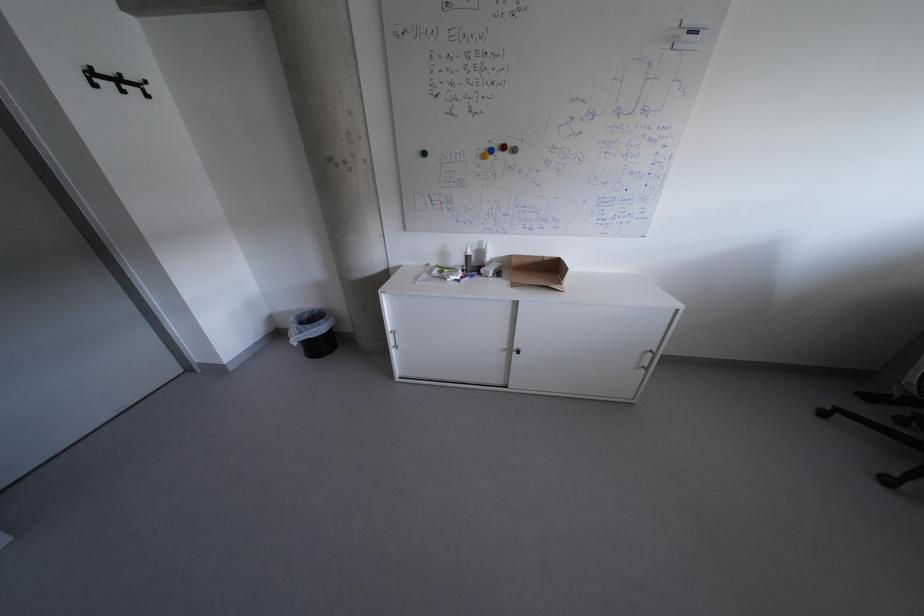
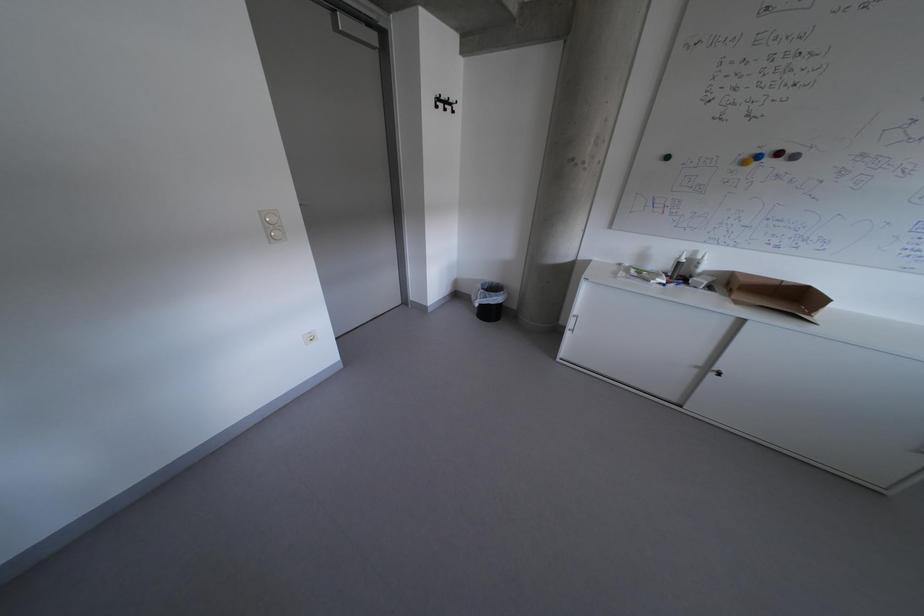
Question: The camera is either moving clockwise (left) or counter-clockwise (right) around the object. The first image is from the beginning of the video and the second image is from the end. Is the camera moving left or right when shooting the video?

Choices:
 (A) Left
 (B) Right

Answer: (B)